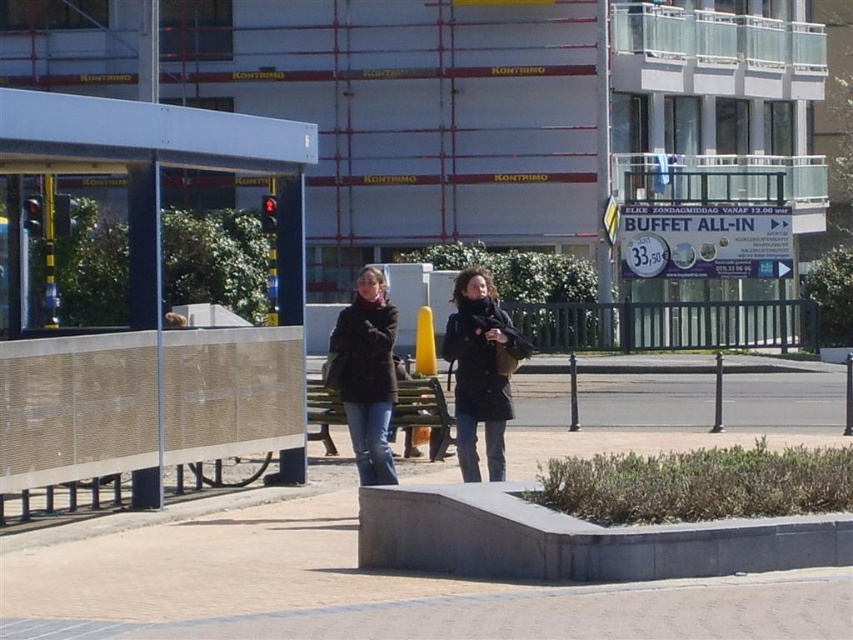
Question: Which of the following is the closest to the observer?

Choices:
 (A) dark brown leather jacket at center
 (B) metallic silver bus stop at left
 (C) wooden park bench at center
 (D) matte black coat at center

Answer: (D)

Question: Does matte black coat at center have a larger size compared to wooden park bench at center?

Choices:
 (A) yes
 (B) no

Answer: (B)

Question: Among these points, which one is nearest to the camera?

Choices:
 (A) (273, 164)
 (B) (416, 449)

Answer: (A)

Question: Is matte black coat at center positioned behind dark brown leather jacket at center?

Choices:
 (A) no
 (B) yes

Answer: (A)

Question: Does dark brown leather jacket at center lie behind wooden park bench at center?

Choices:
 (A) no
 (B) yes

Answer: (A)

Question: Which of these objects is positioned farthest from the wooden park bench at center?

Choices:
 (A) dark brown leather jacket at center
 (B) matte black coat at center

Answer: (B)